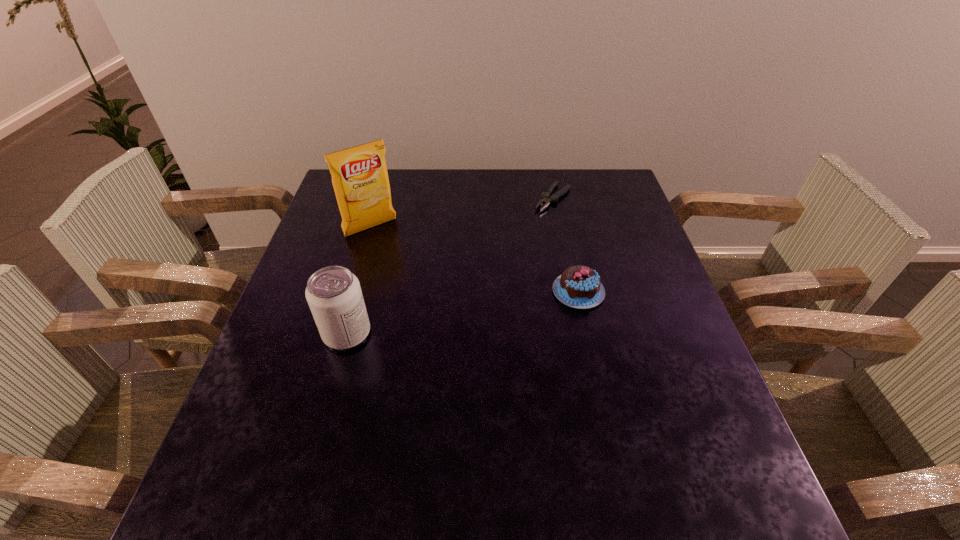
Image resolution: width=960 pixels, height=540 pixels. I want to click on vacant space on the desktop that is between the soda can and the second shortest object and is positioned on the front of the third nearest object with the logo, so click(441, 316).

Locate an element on the screen. The height and width of the screenshot is (540, 960). vacant spot on the desktop that is between the third shortest object and the third farthest object and is positioned at the gripping part of the pliers is located at coordinates (438, 317).